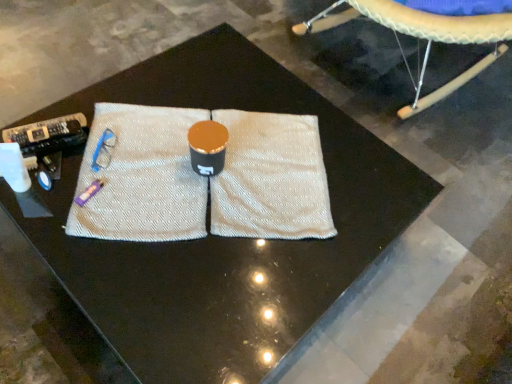
Question: From the image's perspective, is beige leather cushion at upper right positioned above or below white textured yoga mat at center?

Choices:
 (A) above
 (B) below

Answer: (A)

Question: Considering the positions of point (438, 18) and point (274, 231), is point (438, 18) closer or farther from the camera than point (274, 231)?

Choices:
 (A) farther
 (B) closer

Answer: (A)

Question: From a real-world perspective, is beige leather cushion at upper right positioned above or below white textured yoga mat at center?

Choices:
 (A) below
 (B) above

Answer: (B)

Question: From their relative heights in the image, would you say white textured yoga mat at center is taller or shorter than beige leather cushion at upper right?

Choices:
 (A) tall
 (B) short

Answer: (B)

Question: In the image, is white textured yoga mat at center positioned in front of or behind beige leather cushion at upper right?

Choices:
 (A) front
 (B) behind

Answer: (A)

Question: Is white textured yoga mat at center inside the boundaries of beige leather cushion at upper right, or outside?

Choices:
 (A) inside
 (B) outside

Answer: (B)

Question: From a real-world perspective, is white textured yoga mat at center positioned above or below beige leather cushion at upper right?

Choices:
 (A) below
 (B) above

Answer: (A)